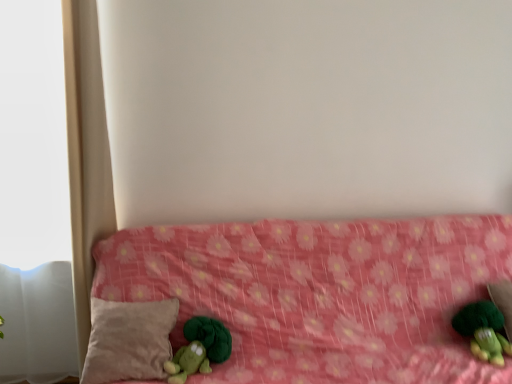
At what (x,y) coordinates should I click in order to perform the action: click on pink fabric bed at center. Please return your answer as a coordinate pair (x, y). Image resolution: width=512 pixels, height=384 pixels. Looking at the image, I should click on (320, 294).

From the picture: What is the approximate height of green plush toy at lower right, positioned as the first toy in right-to-left order?

green plush toy at lower right, positioned as the first toy in right-to-left order, is 7.82 inches in height.

The height and width of the screenshot is (384, 512). Find the location of `beige soft pillow at lower left`. beige soft pillow at lower left is located at coordinates (129, 340).

What do you see at coordinates (129, 340) in the screenshot? This screenshot has width=512, height=384. I see `beige soft pillow at lower left` at bounding box center [129, 340].

Where is `green plush toy at lower left, placed as the 2th toy when sorted from right to left`? Image resolution: width=512 pixels, height=384 pixels. green plush toy at lower left, placed as the 2th toy when sorted from right to left is located at coordinates (199, 349).

How different are the orientations of beige soft pillow at lower left and green plush toy at lower right, the second toy when ordered from left to right, in degrees?

4.35 degrees.

Consider the image. Visually, is beige soft pillow at lower left positioned to the left or to the right of green plush toy at lower right, the second toy when ordered from left to right?

From the image, it's evident that beige soft pillow at lower left is to the left of green plush toy at lower right, the second toy when ordered from left to right.

From the image's perspective, which is above, beige soft pillow at lower left or green plush toy at lower right, the second toy when ordered from left to right?

From the image's view, green plush toy at lower right, the second toy when ordered from left to right, is above.

Are beige soft pillow at lower left and green plush toy at lower right, the second toy when ordered from left to right, located far from each other?

That's right, there is a large distance between beige soft pillow at lower left and green plush toy at lower right, the second toy when ordered from left to right.

From a real-world perspective, is pink fabric bed at center located beneath green plush toy at lower left, positioned as the first toy in left-to-right order?

Correct, in the physical world, pink fabric bed at center is lower than green plush toy at lower left, positioned as the first toy in left-to-right order.

From the image's perspective, is pink fabric bed at center over green plush toy at lower left, placed as the 2th toy when sorted from right to left?

No.

Image resolution: width=512 pixels, height=384 pixels. In the image, there is a green plush toy at lower left, positioned as the first toy in left-to-right order. In order to click on furniture below it (from a real-world perspective) in this screenshot , I will do `click(320, 294)`.

Is green plush toy at lower left, placed as the 2th toy when sorted from right to left, at the back of pink fabric bed at center?

Yes, pink fabric bed at center is facing away from green plush toy at lower left, placed as the 2th toy when sorted from right to left.

Which is less distant, [492,362] or [176,354]?

Point [492,362] appears to be farther away from the viewer than point [176,354].

Between green plush toy at lower right, the second toy when ordered from left to right, and green plush toy at lower left, positioned as the first toy in left-to-right order, which one appears on the left side from the viewer's perspective?

From the viewer's perspective, green plush toy at lower left, positioned as the first toy in left-to-right order, appears more on the left side.

Based on the photo, is green plush toy at lower right, positioned as the first toy in right-to-left order, closer to the viewer compared to green plush toy at lower left, placed as the 2th toy when sorted from right to left?

No.

Could you tell me if green plush toy at lower right, positioned as the first toy in right-to-left order, is turned towards green plush toy at lower left, placed as the 2th toy when sorted from right to left?

No, green plush toy at lower right, positioned as the first toy in right-to-left order, is not turned towards green plush toy at lower left, placed as the 2th toy when sorted from right to left.

Is pink fabric bed at center spatially inside beige soft pillow at lower left, or outside of it?

pink fabric bed at center is outside beige soft pillow at lower left.

From a real-world perspective, between pink fabric bed at center and beige soft pillow at lower left, who is vertically lower?

From a 3D spatial view, pink fabric bed at center is below.

Looking at this image, does pink fabric bed at center have a larger size compared to beige soft pillow at lower left?

Yes, pink fabric bed at center is bigger than beige soft pillow at lower left.

Looking at this image, would you consider pink fabric bed at center to be distant from beige soft pillow at lower left?

Actually, pink fabric bed at center and beige soft pillow at lower left are a little close together.

Measure the distance between green plush toy at lower left, positioned as the first toy in left-to-right order, and beige soft pillow at lower left.

green plush toy at lower left, positioned as the first toy in left-to-right order, is 6.10 inches from beige soft pillow at lower left.

From the image's perspective, is green plush toy at lower left, positioned as the first toy in left-to-right order, below beige soft pillow at lower left?

Yes.

Is green plush toy at lower left, positioned as the first toy in left-to-right order, with beige soft pillow at lower left?

No, green plush toy at lower left, positioned as the first toy in left-to-right order, is not with beige soft pillow at lower left.

How different are the orientations of green plush toy at lower left, positioned as the first toy in left-to-right order, and green plush toy at lower right, positioned as the first toy in right-to-left order, in degrees?

They differ by 9.23e-05 degrees in their facing directions.

Does green plush toy at lower left, positioned as the first toy in left-to-right order, turn towards green plush toy at lower right, the second toy when ordered from left to right?

No, green plush toy at lower left, positioned as the first toy in left-to-right order, does not turn towards green plush toy at lower right, the second toy when ordered from left to right.

The width and height of the screenshot is (512, 384). In order to click on toy in front of the green plush toy at lower right, positioned as the first toy in right-to-left order in this screenshot , I will do `click(199, 349)`.

Is green plush toy at lower left, placed as the 2th toy when sorted from right to left, in contact with green plush toy at lower right, positioned as the first toy in right-to-left order?

There is a gap between green plush toy at lower left, placed as the 2th toy when sorted from right to left, and green plush toy at lower right, positioned as the first toy in right-to-left order.

Is pink fabric bed at center wider or thinner than green plush toy at lower right, positioned as the first toy in right-to-left order?

pink fabric bed at center is wider than green plush toy at lower right, positioned as the first toy in right-to-left order.

Could you tell me if pink fabric bed at center is turned towards green plush toy at lower right, positioned as the first toy in right-to-left order?

Yes, pink fabric bed at center is turned towards green plush toy at lower right, positioned as the first toy in right-to-left order.

Which of these two, pink fabric bed at center or green plush toy at lower right, positioned as the first toy in right-to-left order, stands shorter?

With less height is green plush toy at lower right, positioned as the first toy in right-to-left order.

This screenshot has height=384, width=512. There is a green plush toy at lower right, positioned as the first toy in right-to-left order. What are the coordinates of `pillow above it (from a real-world perspective)` in the screenshot? It's located at (129, 340).

You are a GUI agent. You are given a task and a screenshot of the screen. Output one action in this format:
    pyautogui.click(x=<x>, y=<y>)
    Task: Click on the furniture below the green plush toy at lower left, positioned as the first toy in left-to-right order (from the image's perspective)
    
    Given the screenshot: What is the action you would take?
    pyautogui.click(x=320, y=294)

Which object lies further to the anchor point beige soft pillow at lower left, green plush toy at lower right, the second toy when ordered from left to right, or green plush toy at lower left, placed as the 2th toy when sorted from right to left?

green plush toy at lower right, the second toy when ordered from left to right, is positioned further to the anchor beige soft pillow at lower left.

Looking at the image, which one is located further to pink fabric bed at center, green plush toy at lower left, positioned as the first toy in left-to-right order, or green plush toy at lower right, positioned as the first toy in right-to-left order?

green plush toy at lower right, positioned as the first toy in right-to-left order, is positioned further to the anchor pink fabric bed at center.

Based on their spatial positions, is beige soft pillow at lower left or green plush toy at lower left, positioned as the first toy in left-to-right order, closer to green plush toy at lower right, positioned as the first toy in right-to-left order?

green plush toy at lower left, positioned as the first toy in left-to-right order, is closer to green plush toy at lower right, positioned as the first toy in right-to-left order.

Looking at the image, which one is located further to beige soft pillow at lower left, green plush toy at lower left, positioned as the first toy in left-to-right order, or pink fabric bed at center?

The object further to beige soft pillow at lower left is pink fabric bed at center.

When comparing their distances from pink fabric bed at center, does beige soft pillow at lower left or green plush toy at lower right, positioned as the first toy in right-to-left order, seem closer?

beige soft pillow at lower left lies closer to pink fabric bed at center than the other object.

Considering their positions, is green plush toy at lower left, positioned as the first toy in left-to-right order, positioned further to green plush toy at lower right, the second toy when ordered from left to right, than pink fabric bed at center?

green plush toy at lower left, positioned as the first toy in left-to-right order.

Estimate the real-world distances between objects in this image. Which object is further from green plush toy at lower left, placed as the 2th toy when sorted from right to left, pink fabric bed at center or beige soft pillow at lower left?

Among the two, pink fabric bed at center is located further to green plush toy at lower left, placed as the 2th toy when sorted from right to left.

Based on their spatial positions, is green plush toy at lower right, positioned as the first toy in right-to-left order, or pink fabric bed at center further from green plush toy at lower left, positioned as the first toy in left-to-right order?

Based on the image, green plush toy at lower right, positioned as the first toy in right-to-left order, appears to be further to green plush toy at lower left, positioned as the first toy in left-to-right order.

Find the location of a particular element. The width and height of the screenshot is (512, 384). toy between beige soft pillow at lower left and green plush toy at lower right, positioned as the first toy in right-to-left order, in the horizontal direction is located at coordinates (199, 349).

Where is `furniture located between beige soft pillow at lower left and green plush toy at lower right, positioned as the first toy in right-to-left order, in the left-right direction`? The image size is (512, 384). furniture located between beige soft pillow at lower left and green plush toy at lower right, positioned as the first toy in right-to-left order, in the left-right direction is located at coordinates (320, 294).

The image size is (512, 384). I want to click on furniture located between green plush toy at lower left, placed as the 2th toy when sorted from right to left, and green plush toy at lower right, positioned as the first toy in right-to-left order, in the left-right direction, so click(x=320, y=294).

Identify the location of toy between beige soft pillow at lower left and pink fabric bed at center from left to right. (199, 349).